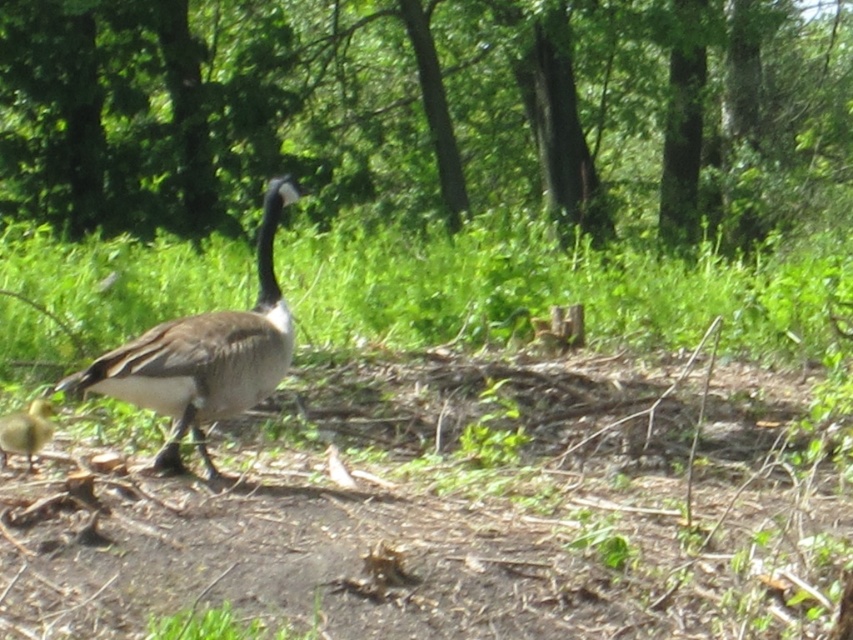
Does green leafy tree at upper center appear over brown feathered goose at center?

Correct, green leafy tree at upper center is located above brown feathered goose at center.

Based on the photo, does green leafy tree at upper center have a greater height compared to brown feathered goose at center?

Correct, green leafy tree at upper center is much taller as brown feathered goose at center.

Is point (473, 136) positioned in front of point (235, 371)?

No, (473, 136) is behind (235, 371).

What are the coordinates of `green leafy tree at upper center` in the screenshot? It's located at (422, 112).

Between green leafy tree at upper center and green grass at center, which one appears on the right side from the viewer's perspective?

green leafy tree at upper center is more to the right.

Which is above, green leafy tree at upper center or green grass at center?

green leafy tree at upper center is above.

The height and width of the screenshot is (640, 853). In order to click on green leafy tree at upper center in this screenshot , I will do `click(422, 112)`.

This screenshot has width=853, height=640. What are the coordinates of `green leafy tree at upper center` in the screenshot? It's located at (422, 112).

Which of these two, green grass at center or brown feathered goose at center, stands shorter?

With less height is green grass at center.

Can you confirm if green grass at center is positioned above brown feathered goose at center?

Correct, green grass at center is located above brown feathered goose at center.

Measure the distance between point (x=167, y=310) and camera.

Point (x=167, y=310) is 6.94 meters away from camera.

This screenshot has height=640, width=853. I want to click on green grass at center, so click(x=554, y=292).